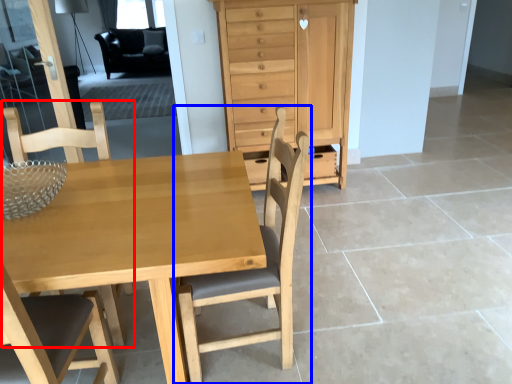
Question: Among these objects, which one is nearest to the camera, chair (highlighted by a red box) or chair (highlighted by a blue box)?

Choices:
 (A) chair
 (B) chair

Answer: (B)